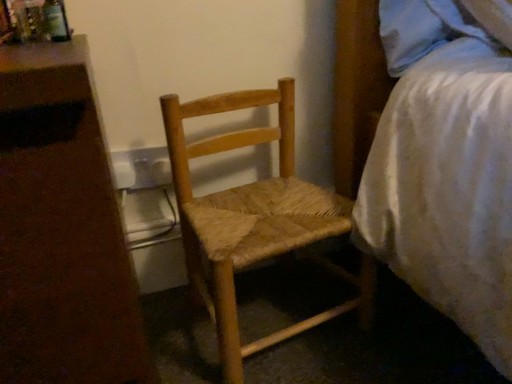
The width and height of the screenshot is (512, 384). Describe the element at coordinates (62, 230) in the screenshot. I see `white plastic nightstand at left` at that location.

The image size is (512, 384). What do you see at coordinates (432, 173) in the screenshot? I see `white textured bed at right` at bounding box center [432, 173].

Where is `white plastic nightstand at left`? This screenshot has height=384, width=512. white plastic nightstand at left is located at coordinates (62, 230).

Between point (55, 300) and point (422, 259), which one is positioned behind?

The point (422, 259) is farther.

Is white plastic nightstand at left far away from white textured bed at right?

They are positioned close to each other.

Who is taller, white plastic nightstand at left or white textured bed at right?

With more height is white plastic nightstand at left.

From a real-world perspective, which is physically below, white plastic nightstand at left or white textured bed at right?

white plastic nightstand at left.

Considering the sizes of objects white textured bed at right and natural wood woven chair at center in the image provided, who is thinner, white textured bed at right or natural wood woven chair at center?

natural wood woven chair at center is thinner.

This screenshot has height=384, width=512. I want to click on chair lying behind the white textured bed at right, so (x=254, y=218).

Based on the photo, which of these two, white textured bed at right or natural wood woven chair at center, stands shorter?

With less height is white textured bed at right.

Which is less distant, (396, 143) or (343, 217)?

Point (396, 143).

Is white textured bed at right at the back of natural wood woven chair at center?

No.

Based on the photo, how far apart are natural wood woven chair at center and white textured bed at right?

The distance of natural wood woven chair at center from white textured bed at right is 19.28 centimeters.

Is natural wood woven chair at center thinner than white textured bed at right?

Indeed, natural wood woven chair at center has a lesser width compared to white textured bed at right.

Identify the location of bed above the natural wood woven chair at center (from a real-world perspective). This screenshot has width=512, height=384. (432, 173).

From a real-world perspective, who is located lower, natural wood woven chair at center or white plastic nightstand at left?

natural wood woven chair at center is physically lower.

How different are the orientations of natural wood woven chair at center and white plastic nightstand at left in degrees?

The angular difference between natural wood woven chair at center and white plastic nightstand at left is 5.37 degrees.

Where is `nightstand above the natural wood woven chair at center (from a real-world perspective)`? This screenshot has height=384, width=512. nightstand above the natural wood woven chair at center (from a real-world perspective) is located at coordinates (62, 230).

Considering the sizes of objects natural wood woven chair at center and white plastic nightstand at left in the image provided, who is shorter, natural wood woven chair at center or white plastic nightstand at left?

natural wood woven chair at center is shorter.

Between white textured bed at right and white plastic nightstand at left, which one is positioned in front?

white plastic nightstand at left is closer to the camera.

Is white plastic nightstand at left inside white textured bed at right?

No, white plastic nightstand at left is located outside of white textured bed at right.

Is white textured bed at right placed right next to white plastic nightstand at left?

No, white textured bed at right is not touching white plastic nightstand at left.

Is white plastic nightstand at left oriented towards natural wood woven chair at center?

No, white plastic nightstand at left is not oriented towards natural wood woven chair at center.

From the image's perspective, who appears lower, white plastic nightstand at left or natural wood woven chair at center?

white plastic nightstand at left, from the image's perspective.

Based on their sizes in the image, would you say white plastic nightstand at left is bigger or smaller than natural wood woven chair at center?

Clearly, white plastic nightstand at left is larger in size than natural wood woven chair at center.

Can natural wood woven chair at center be found inside white plastic nightstand at left?

No, natural wood woven chair at center is located outside of white plastic nightstand at left.

The height and width of the screenshot is (384, 512). I want to click on nightstand directly beneath the white textured bed at right (from a real-world perspective), so (x=62, y=230).

I want to click on bed above the natural wood woven chair at center (from a real-world perspective), so click(432, 173).

Estimate the real-world distances between objects in this image. Which object is further from white plastic nightstand at left, white textured bed at right or natural wood woven chair at center?

Among the two, white textured bed at right is located further to white plastic nightstand at left.

Estimate the real-world distances between objects in this image. Which object is closer to white textured bed at right, white plastic nightstand at left or natural wood woven chair at center?

The object closer to white textured bed at right is natural wood woven chair at center.

Considering their positions, is natural wood woven chair at center positioned further to white plastic nightstand at left than white textured bed at right?

white textured bed at right is further to white plastic nightstand at left.

Which object lies further to the anchor point white textured bed at right, natural wood woven chair at center or white plastic nightstand at left?

white plastic nightstand at left is positioned further to the anchor white textured bed at right.

Considering their positions, is white textured bed at right positioned further to natural wood woven chair at center than white plastic nightstand at left?

The object further to natural wood woven chair at center is white plastic nightstand at left.

Considering their positions, is white plastic nightstand at left positioned closer to natural wood woven chair at center than white textured bed at right?

white textured bed at right is closer to natural wood woven chair at center.

The width and height of the screenshot is (512, 384). I want to click on chair located between white plastic nightstand at left and white textured bed at right in the left-right direction, so click(x=254, y=218).